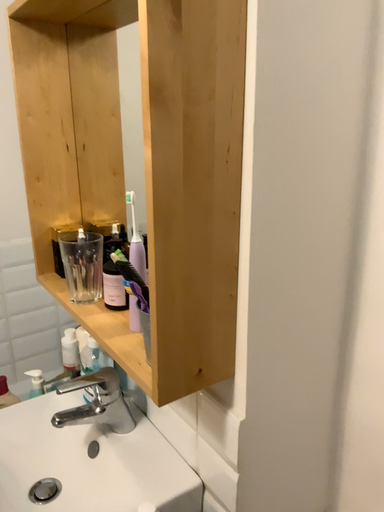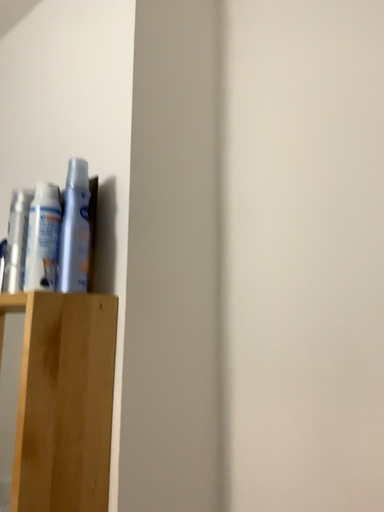
Question: Which way did the camera rotate in the video?

Choices:
 (A) rotated downward
 (B) rotated upward

Answer: (B)